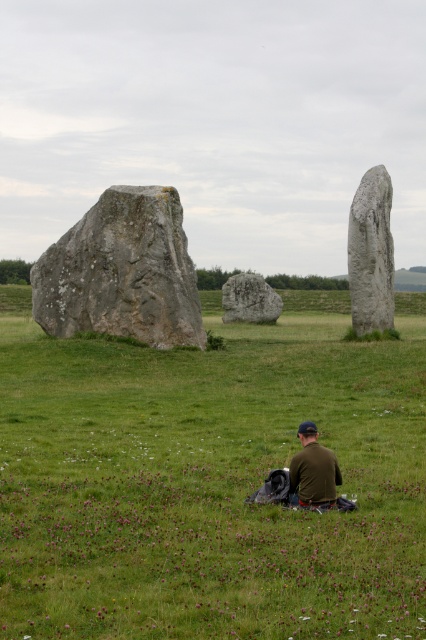
You are standing at the origin point of the coordinate system in this image. You want to walk to the gray stone at center. What are the coordinates you need to move to?

The coordinates you need to move to are approximately 0.758 on the x axis and 0.493 on the y axis.